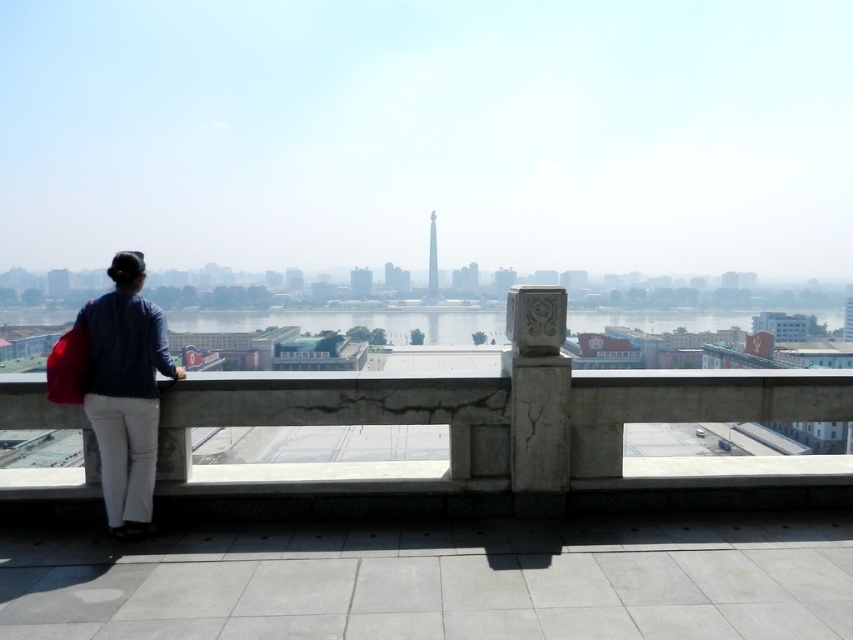
Question: Is concrete at left in front of denim jacket at left?

Choices:
 (A) no
 (B) yes

Answer: (A)

Question: Which point is closer to the camera?

Choices:
 (A) denim jacket at left
 (B) concrete at left

Answer: (A)

Question: Does concrete at left lie in front of denim jacket at left?

Choices:
 (A) no
 (B) yes

Answer: (A)

Question: Can you confirm if concrete at left is wider than denim jacket at left?

Choices:
 (A) no
 (B) yes

Answer: (A)

Question: Among these objects, which one is nearest to the camera?

Choices:
 (A) denim jacket at left
 (B) concrete at left

Answer: (A)

Question: Which point is farther to the camera?

Choices:
 (A) 119,512
 (B) 798,397

Answer: (B)